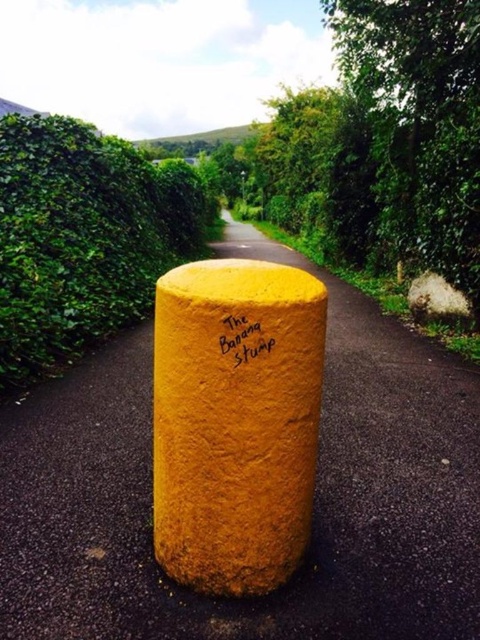
Question: Is yellow textured bollard at center to the left of yellow matte the banana stump at center from the viewer's perspective?

Choices:
 (A) no
 (B) yes

Answer: (A)

Question: Which point is farther to the camera?

Choices:
 (A) yellow matte pole at center
 (B) green leafy hedge at left
 (C) yellow matte the banana stump at center
 (D) yellow textured bollard at center

Answer: (B)

Question: Observing the image, what is the correct spatial positioning of green leafy hedge at left in reference to yellow matte the banana stump at center?

Choices:
 (A) above
 (B) below

Answer: (A)

Question: Can you confirm if yellow textured bollard at center is positioned to the right of yellow matte the banana stump at center?

Choices:
 (A) yes
 (B) no

Answer: (A)

Question: Estimate the real-world distances between objects in this image. Which object is farther from the yellow matte pole at center?

Choices:
 (A) yellow textured bollard at center
 (B) yellow matte the banana stump at center
 (C) green leafy hedge at left

Answer: (C)

Question: Which point is closer to the camera?

Choices:
 (A) (235, 340)
 (B) (260, 593)
 (C) (108, 285)

Answer: (A)